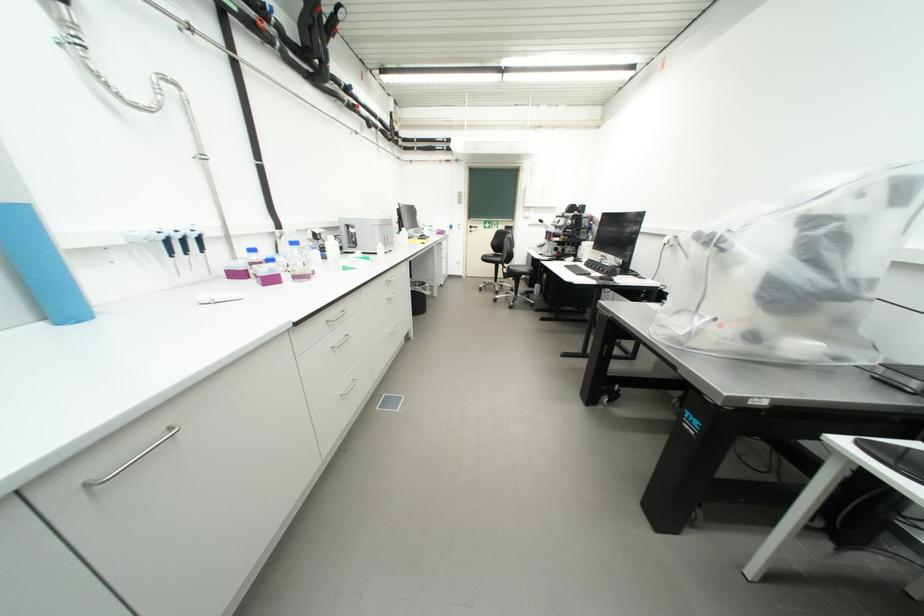
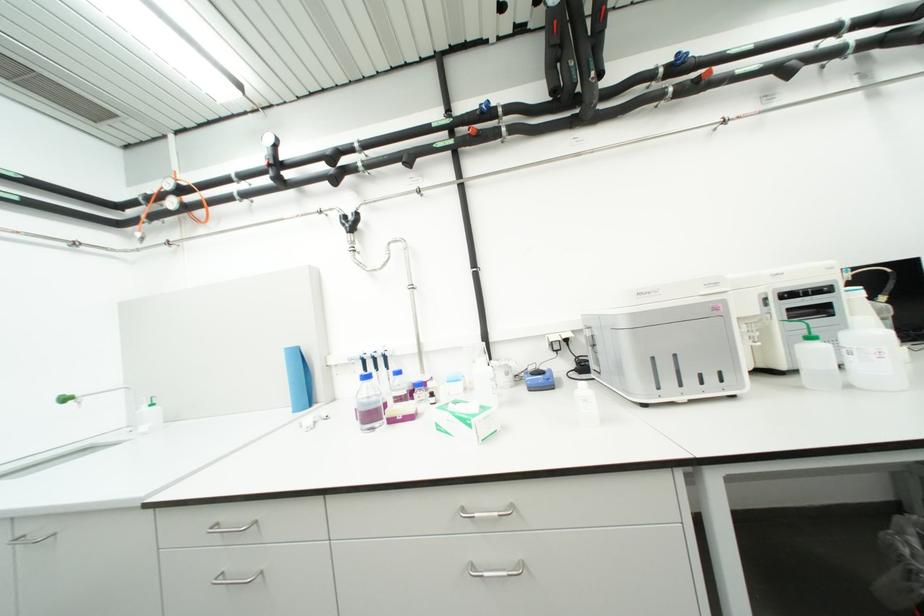
Find the pixel in the second image that matches (x=353, y=270) in the first image.

(446, 429)